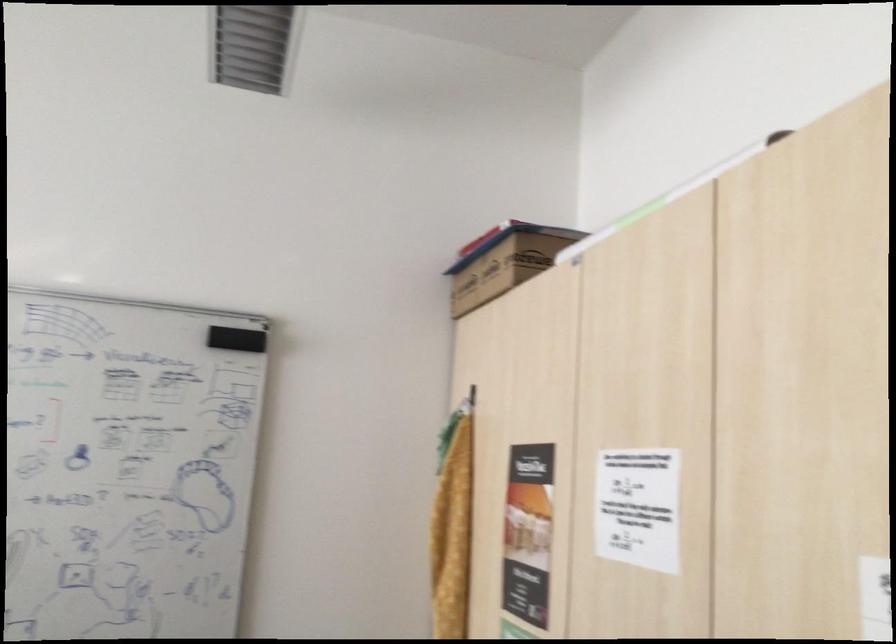
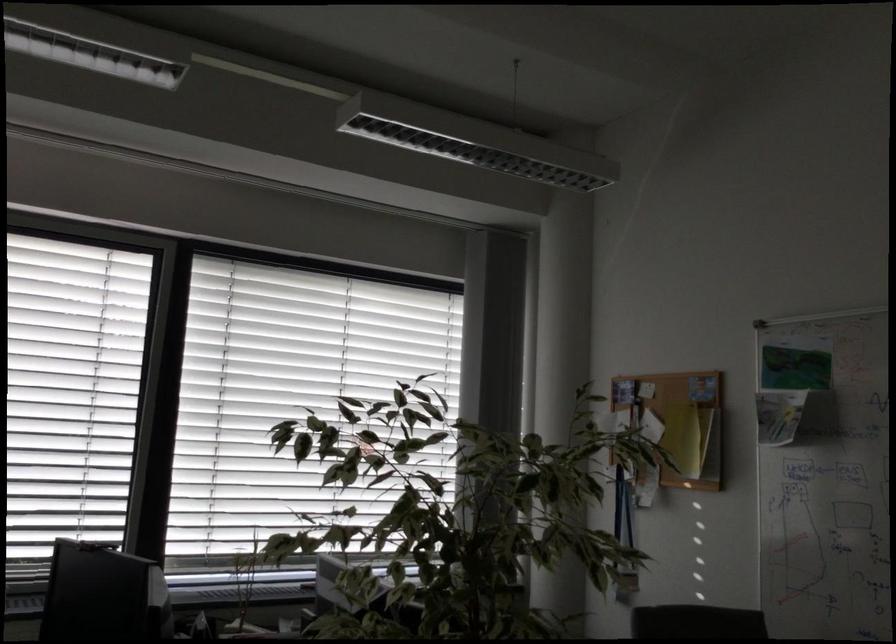
Question: Based on the continuous images, in which direction is the camera rotating? Reply with the corresponding letter.

Choices:
 (A) Left
 (B) Right
 (C) Up
 (D) Down

Answer: (A)